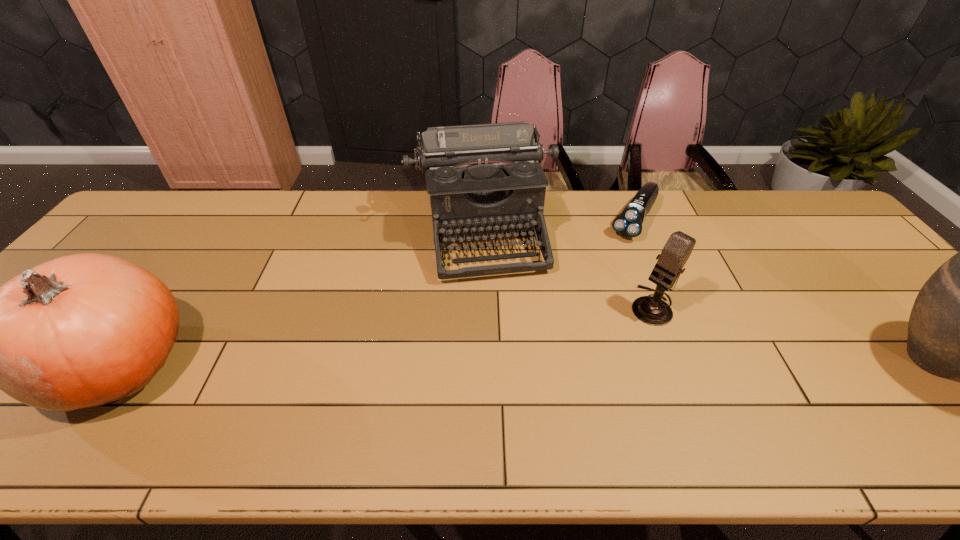
Identify the location of free spot on the desktop that is between the pumpkin and the urn and is positioned on the head of the electric shaver. The width and height of the screenshot is (960, 540). (540, 363).

The height and width of the screenshot is (540, 960). Identify the location of vacant space on the desktop that is between the pumpkin and the rightmost object and is positioned on the typing side of the second object from left to right. (511, 363).

Locate an element on the screen. This screenshot has width=960, height=540. vacant space on the desktop that is between the pumpkin and the urn and is positioned on the front-facing side of the microphone is located at coordinates (586, 362).